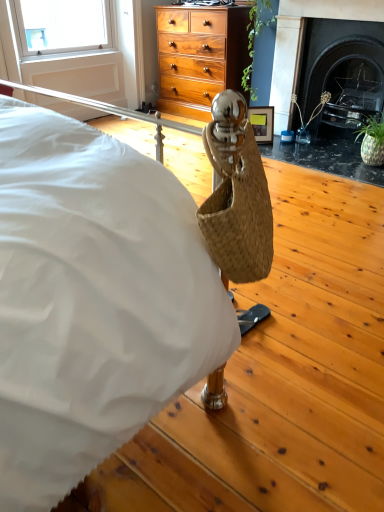
Question: Considering the relative sizes of wooden picture frame at center and black marble fireplace at upper right in the image provided, is wooden picture frame at center wider than black marble fireplace at upper right?

Choices:
 (A) no
 (B) yes

Answer: (A)

Question: Can you confirm if wooden picture frame at center is positioned to the left of black marble fireplace at upper right?

Choices:
 (A) no
 (B) yes

Answer: (B)

Question: Does wooden picture frame at center have a greater height compared to black marble fireplace at upper right?

Choices:
 (A) yes
 (B) no

Answer: (B)

Question: Considering the relative positions of wooden picture frame at center and black marble fireplace at upper right in the image provided, is wooden picture frame at center in front of black marble fireplace at upper right?

Choices:
 (A) yes
 (B) no

Answer: (B)

Question: Does wooden picture frame at center have a lesser height compared to black marble fireplace at upper right?

Choices:
 (A) no
 (B) yes

Answer: (B)

Question: From a real-world perspective, is wooden picture frame at center on top of black marble fireplace at upper right?

Choices:
 (A) no
 (B) yes

Answer: (A)

Question: Is wooden picture frame at center located outside clear glass vase at right, positioned as the second plant in left-to-right order?

Choices:
 (A) no
 (B) yes

Answer: (B)

Question: Is wooden picture frame at center not near clear glass vase at right, placed as the second plant when sorted from top to bottom?

Choices:
 (A) yes
 (B) no

Answer: (B)

Question: Can you confirm if wooden picture frame at center is wider than clear glass vase at right, positioned as the second plant in left-to-right order?

Choices:
 (A) yes
 (B) no

Answer: (B)

Question: Is wooden picture frame at center positioned before clear glass vase at right, positioned as the second plant in left-to-right order?

Choices:
 (A) yes
 (B) no

Answer: (B)

Question: From the image's perspective, is wooden picture frame at center under clear glass vase at right, placed as the second plant when sorted from top to bottom?

Choices:
 (A) yes
 (B) no

Answer: (A)

Question: From the image's perspective, is wooden picture frame at center located above clear glass vase at right, the 1th plant when ordered from right to left?

Choices:
 (A) no
 (B) yes

Answer: (A)

Question: From the image's perspective, is black marble fireplace at upper right beneath wooden picture frame at center?

Choices:
 (A) no
 (B) yes

Answer: (A)